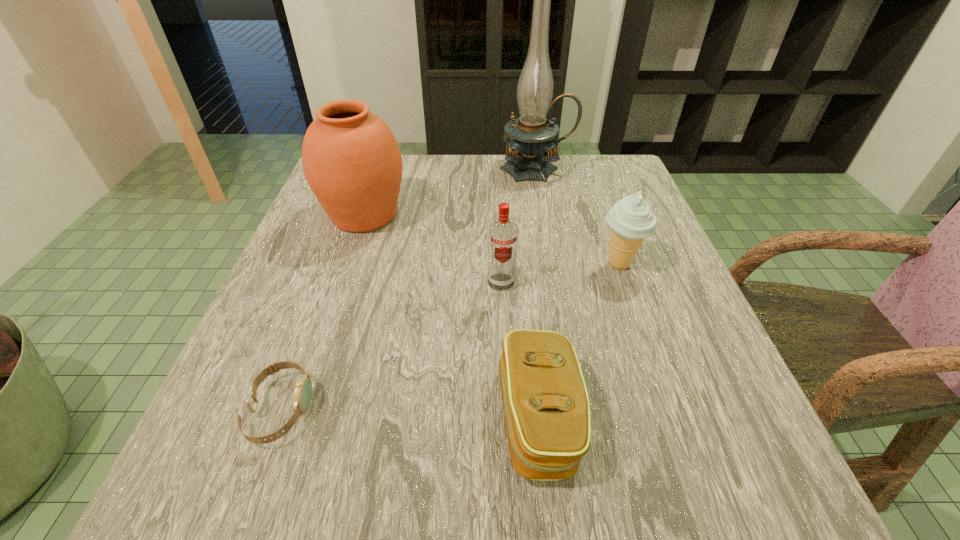
Where is `vacant area that lies between the fifth tallest object and the icecream`? vacant area that lies between the fifth tallest object and the icecream is located at coordinates (579, 341).

Find the location of a particular element. Image resolution: width=960 pixels, height=540 pixels. object that can be found as the closest to the shortest object is located at coordinates (547, 411).

Choose which object is the fifth nearest neighbor to the second farthest object. Please provide its 2D coordinates. Your answer should be formatted as a tuple, i.e. [(x, y)], where the tuple contains the x and y coordinates of a point satisfying the conditions above.

[(631, 220)]

At what (x,y) coordinates should I click in order to perform the action: click on vacant area that satisfies the following two spatial constraints: 1. on the back side of the oil lamp; 2. on the right side of the second farthest object. Please return your answer as a coordinate pair (x, y). The width and height of the screenshot is (960, 540). Looking at the image, I should click on (379, 169).

This screenshot has width=960, height=540. Identify the location of free space that satisfies the following two spatial constraints: 1. on the front side of the icecream; 2. on the zipper side of the clutch bag. (674, 418).